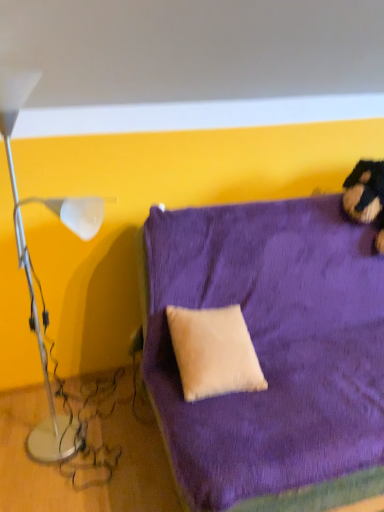
Image resolution: width=384 pixels, height=512 pixels. Find the location of `vacant space in white glossy lamp at left (from a real-world perspective)`. vacant space in white glossy lamp at left (from a real-world perspective) is located at coordinates (72, 467).